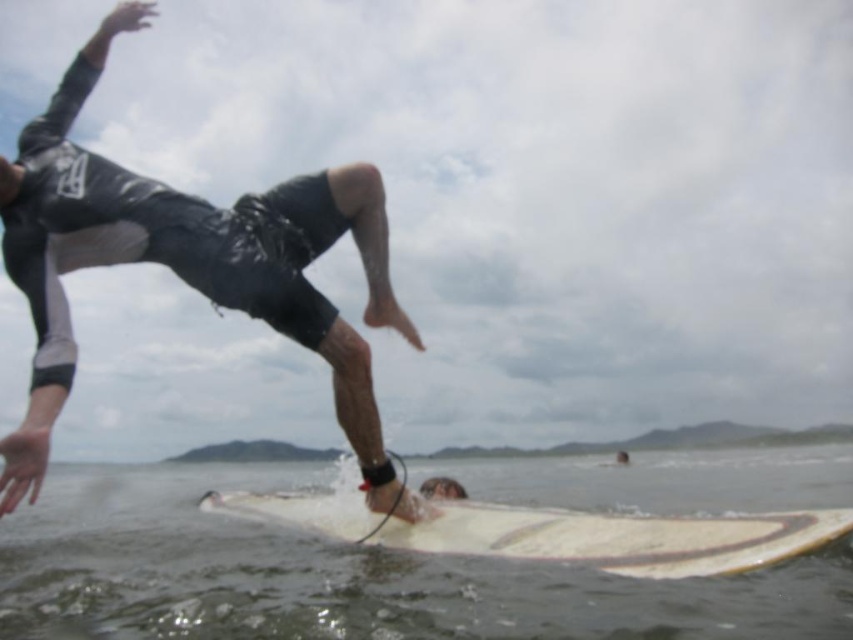
Question: Among these objects, which one is nearest to the camera?

Choices:
 (A) white smooth surfboard at lower center
 (B) white smooth surfboard at center
 (C) gray wetsuit surfer at left

Answer: (A)

Question: Is gray wetsuit surfer at left positioned before white smooth surfboard at lower center?

Choices:
 (A) no
 (B) yes

Answer: (A)

Question: Which of the following is the closest to the observer?

Choices:
 (A) (560, 547)
 (B) (364, 173)

Answer: (A)

Question: Which point is closer to the camera?

Choices:
 (A) white smooth surfboard at lower center
 (B) gray wetsuit surfer at left
 (C) white smooth surfboard at center

Answer: (A)

Question: Does white smooth surfboard at center appear on the left side of white smooth surfboard at lower center?

Choices:
 (A) no
 (B) yes

Answer: (B)

Question: Can you confirm if white smooth surfboard at center is positioned to the right of white smooth surfboard at lower center?

Choices:
 (A) yes
 (B) no

Answer: (B)